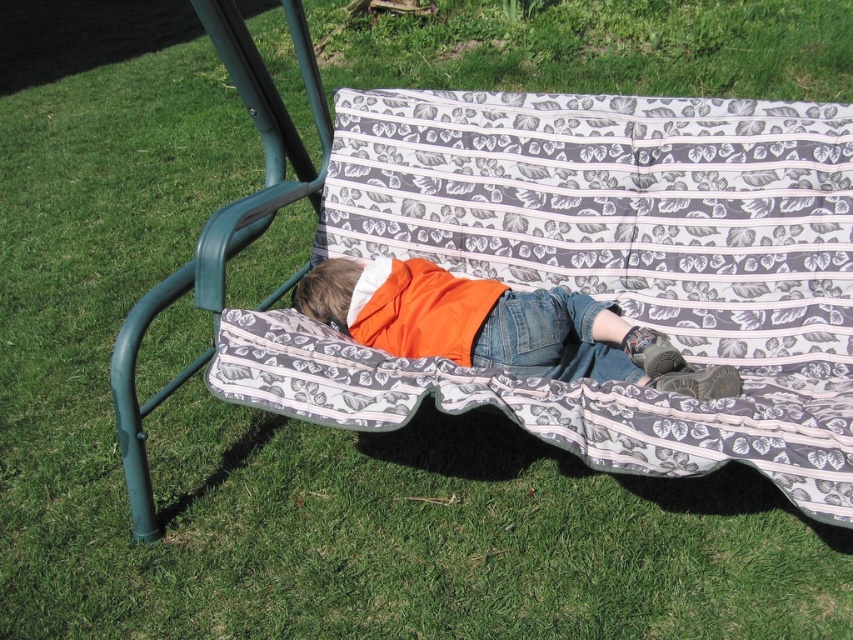
Question: Is patterned fabric blanket at center to the right of orange fabric shirt at center from the viewer's perspective?

Choices:
 (A) yes
 (B) no

Answer: (A)

Question: Does patterned fabric blanket at center appear on the left side of orange fabric shirt at center?

Choices:
 (A) no
 (B) yes

Answer: (A)

Question: Which point is closer to the camera?

Choices:
 (A) (474, 333)
 (B) (592, 198)

Answer: (A)

Question: Considering the relative positions of patterned fabric blanket at center and orange fabric shirt at center in the image provided, where is patterned fabric blanket at center located with respect to orange fabric shirt at center?

Choices:
 (A) left
 (B) right

Answer: (B)